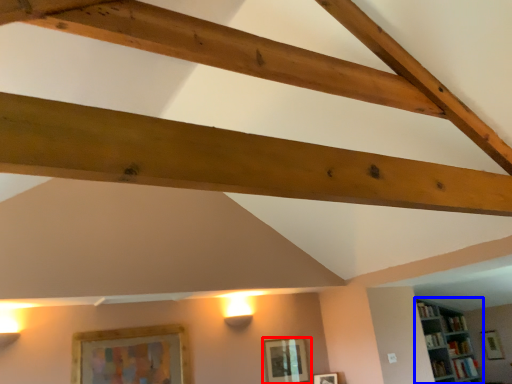
Question: Which object appears farthest to the camera in this image, picture frame (highlighted by a red box) or shelf (highlighted by a blue box)?

Choices:
 (A) picture frame
 (B) shelf

Answer: (B)